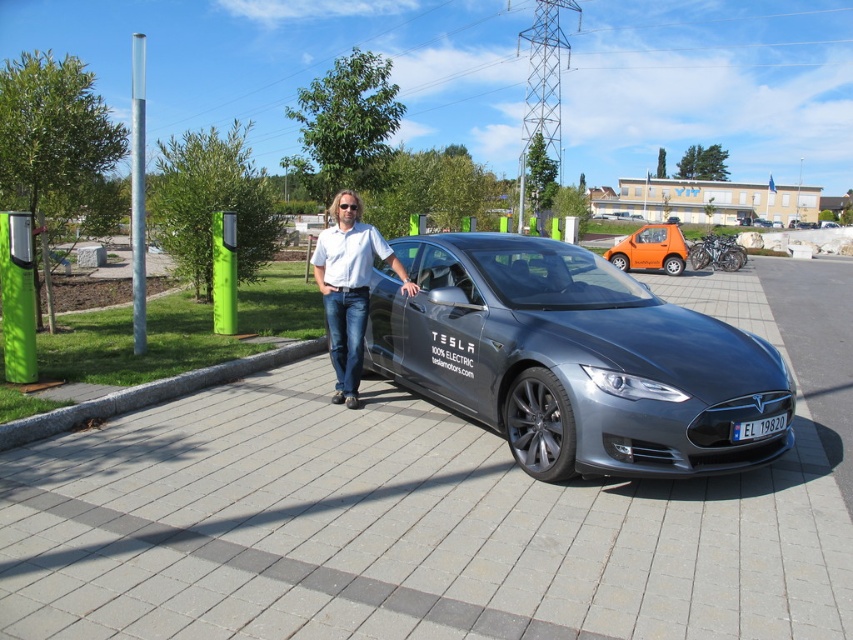
Question: Among these objects, which one is farthest from the camera?

Choices:
 (A) blue metallic license plate at center
 (B) sleek metallic tesla at center
 (C) gray concrete curb at lower left

Answer: (C)

Question: Which point is closer to the camera?

Choices:
 (A) white shirt at center
 (B) sleek metallic tesla at center
 (C) silver metallic pole at upper left
 (D) orange matte car at center

Answer: (B)

Question: Is silver metallic pole at upper left smaller than orange matte car at center?

Choices:
 (A) yes
 (B) no

Answer: (B)

Question: Estimate the real-world distances between objects in this image. Which object is farther from the blue metallic license plate at center?

Choices:
 (A) silver metallic pole at upper left
 (B) orange matte car at center
 (C) gray concrete curb at lower left
 (D) white shirt at center

Answer: (B)

Question: Is silver metallic pole at upper left to the right of orange matte car at center from the viewer's perspective?

Choices:
 (A) no
 (B) yes

Answer: (A)

Question: Does white shirt at center have a lesser width compared to orange matte car at center?

Choices:
 (A) no
 (B) yes

Answer: (B)